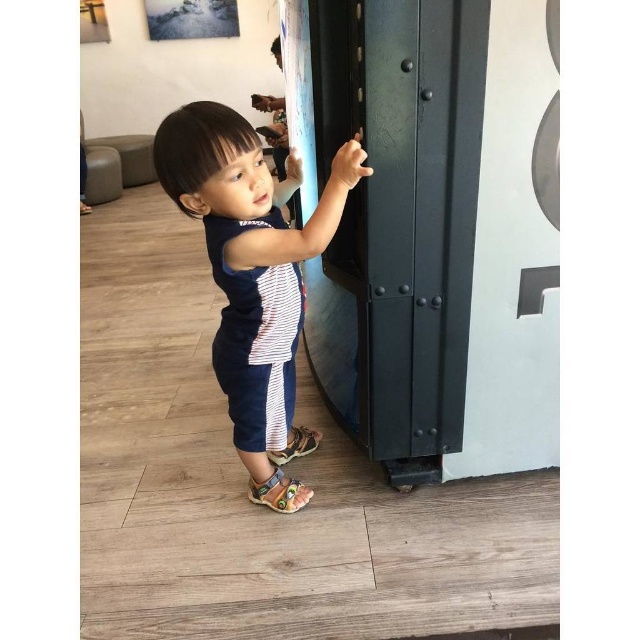
The child is wearing a blue striped shirt at center and a white striped shirt at center. Which one is larger in size?

The blue striped shirt at center is bigger than the white striped shirt at center.

You are a photographer trying to capture the child in the image. You need to ensure both the blue striped shirt at center and the white striped shirt at center are visible in the frame. Which shirt should you position closer to the left side of your camera to include both?

The blue striped shirt at center is to the left of the white striped shirt at center, so positioning the blue striped shirt at center closer to the left side of the camera will ensure both shirts are visible.